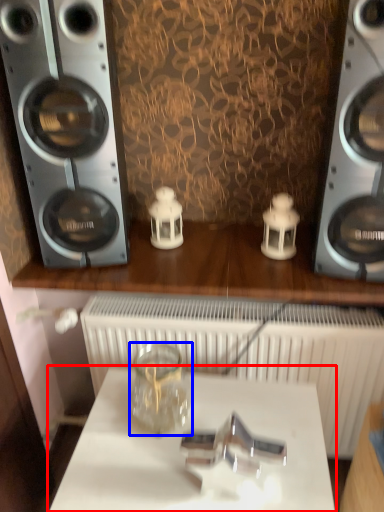
Question: Which of the following is the farthest to the observer, table (highlighted by a red box) or glass jar (highlighted by a blue box)?

Choices:
 (A) table
 (B) glass jar

Answer: (B)